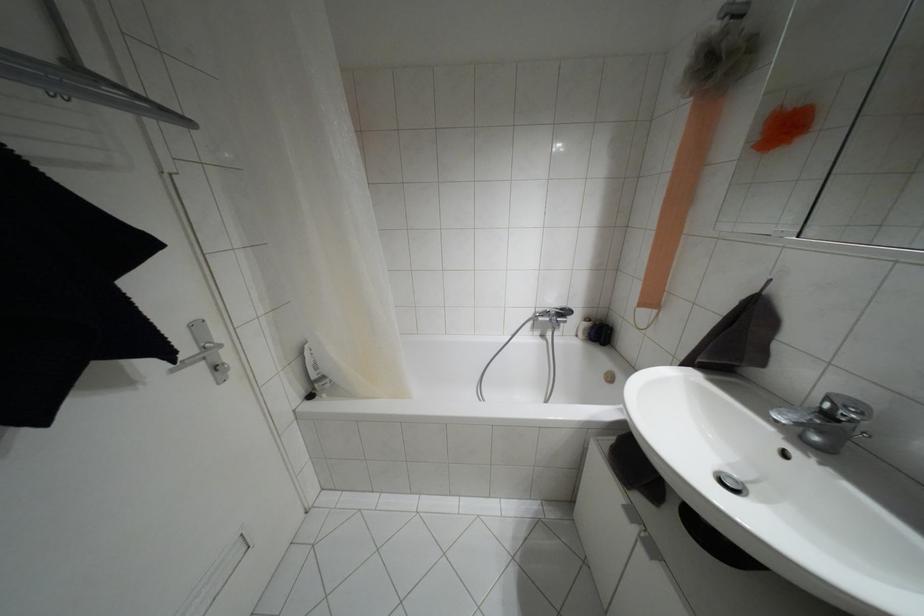
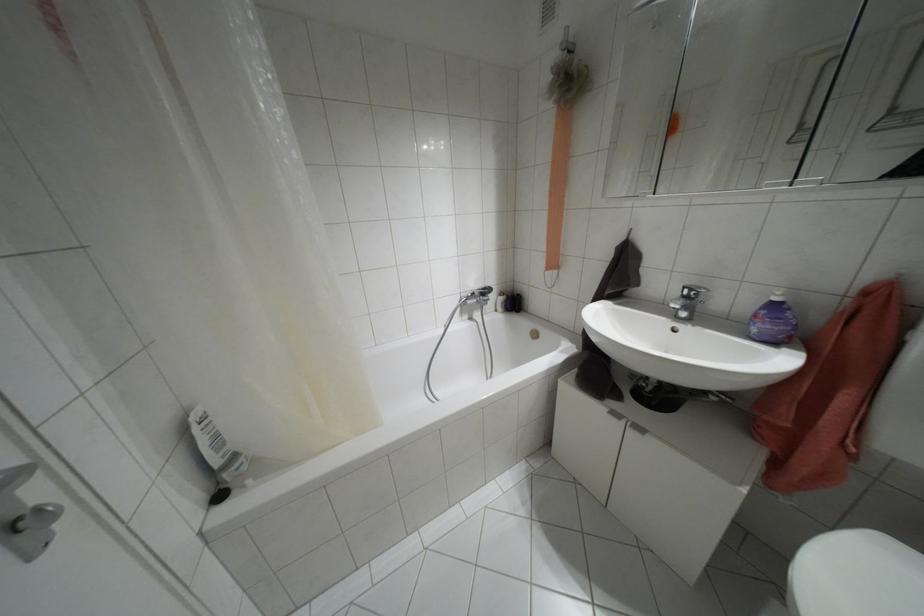
Question: Based on the continuous images, in which direction is the camera rotating? Reply with the corresponding letter.

Choices:
 (A) Left
 (B) Right
 (C) Up
 (D) Down

Answer: (B)